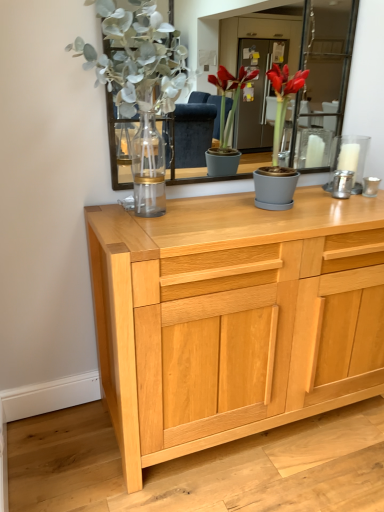
At what (x,y) coordinates should I click in order to perform the action: click on vacant space to the left of matte gray pot at center. Please return your answer as a coordinate pair (x, y). The image size is (384, 512). Looking at the image, I should click on (232, 208).